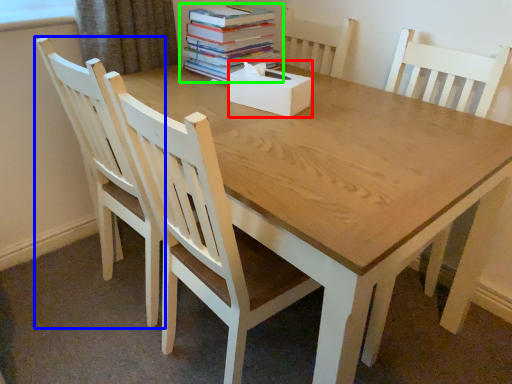
Question: Which object is positioned closest to box (highlighted by a red box)? Select from chair (highlighted by a blue box) and book (highlighted by a green box).

Choices:
 (A) chair
 (B) book

Answer: (B)